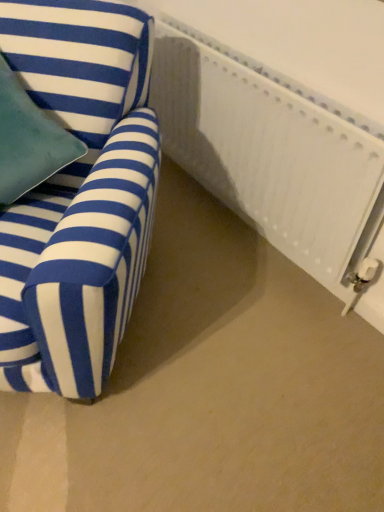
What do you see at coordinates (271, 151) in the screenshot? The image size is (384, 512). I see `white textured radiator at right` at bounding box center [271, 151].

Find the location of a particular element. white textured radiator at right is located at coordinates click(271, 151).

You are a GUI agent. You are given a task and a screenshot of the screen. Output one action in this format:
    pyautogui.click(x=<x>, y=<y>)
    Task: Click on the blue striped fabric chair at left
    The width and height of the screenshot is (384, 512).
    Given the screenshot: What is the action you would take?
    pyautogui.click(x=78, y=196)

The height and width of the screenshot is (512, 384). What do you see at coordinates (78, 196) in the screenshot? I see `blue striped fabric chair at left` at bounding box center [78, 196].

At what (x,y) coordinates should I click in order to perform the action: click on white textured radiator at right. Please return your answer as a coordinate pair (x, y). This screenshot has width=384, height=512. Looking at the image, I should click on (271, 151).

Considering the relative positions of blue striped fabric chair at left and white textured radiator at right in the image provided, is blue striped fabric chair at left to the right of white textured radiator at right from the viewer's perspective?

Incorrect, blue striped fabric chair at left is not on the right side of white textured radiator at right.

Considering the positions of objects blue striped fabric chair at left and white textured radiator at right in the image provided, who is behind, blue striped fabric chair at left or white textured radiator at right?

white textured radiator at right is further from the camera.

Considering the points (153, 204) and (265, 103), which point is in front, point (153, 204) or point (265, 103)?

The point (153, 204) is closer to the camera.

From the image's perspective, is blue striped fabric chair at left below white textured radiator at right?

Yes.

From a real-world perspective, which object stands above the other?

From a 3D spatial view, blue striped fabric chair at left is above.

Can you confirm if blue striped fabric chair at left is thinner than white textured radiator at right?

No.

Considering the relative sizes of blue striped fabric chair at left and white textured radiator at right in the image provided, is blue striped fabric chair at left taller than white textured radiator at right?

Correct, blue striped fabric chair at left is much taller as white textured radiator at right.

Looking at this image, between blue striped fabric chair at left and white textured radiator at right, which one has larger size?

Bigger between the two is blue striped fabric chair at left.

Is blue striped fabric chair at left surrounding white textured radiator at right?

No, white textured radiator at right is not a part of blue striped fabric chair at left.

Would you say blue striped fabric chair at left is a long distance from white textured radiator at right?

No, blue striped fabric chair at left is not far away from white textured radiator at right.

Does blue striped fabric chair at left turn towards white textured radiator at right?

No.

Find the location of a particular element. Image resolution: width=384 pixels, height=512 pixels. chair in front of the white textured radiator at right is located at coordinates (78, 196).

From the picture: Which object is positioned more to the right, white textured radiator at right or blue striped fabric chair at left?

Positioned to the right is white textured radiator at right.

Is white textured radiator at right further to camera compared to blue striped fabric chair at left?

Yes.

Which is behind, point (349, 134) or point (145, 72)?

The point (145, 72) is farther.

From the image's perspective, which is above, white textured radiator at right or blue striped fabric chair at left?

white textured radiator at right, from the image's perspective.

From the picture: From a real-world perspective, is white textured radiator at right located beneath blue striped fabric chair at left?

Yes, from a real-world perspective, white textured radiator at right is beneath blue striped fabric chair at left.

Considering the relative sizes of white textured radiator at right and blue striped fabric chair at left in the image provided, is white textured radiator at right wider than blue striped fabric chair at left?

No.

Consider the image. Considering the relative sizes of white textured radiator at right and blue striped fabric chair at left in the image provided, is white textured radiator at right shorter than blue striped fabric chair at left?

Yes.

Does white textured radiator at right have a larger size compared to blue striped fabric chair at left?

No, white textured radiator at right is not bigger than blue striped fabric chair at left.

Can blue striped fabric chair at left be found inside white textured radiator at right?

No, white textured radiator at right does not contain blue striped fabric chair at left.

Is white textured radiator at right directly adjacent to blue striped fabric chair at left?

white textured radiator at right is not next to blue striped fabric chair at left, and they're not touching.

Is white textured radiator at right oriented away from blue striped fabric chair at left?

Yes, white textured radiator at right's orientation is away from blue striped fabric chair at left.

Measure the distance between white textured radiator at right and blue striped fabric chair at left.

white textured radiator at right and blue striped fabric chair at left are 22.00 inches apart from each other.

You are a GUI agent. You are given a task and a screenshot of the screen. Output one action in this format:
    pyautogui.click(x=<x>, y=<y>)
    Task: Click on the chair above the white textured radiator at right (from a real-world perspective)
    Image resolution: width=384 pixels, height=512 pixels.
    Given the screenshot: What is the action you would take?
    pyautogui.click(x=78, y=196)

Identify the location of chair above the white textured radiator at right (from a real-world perspective). This screenshot has height=512, width=384. (78, 196).

The width and height of the screenshot is (384, 512). I want to click on radiator above the blue striped fabric chair at left (from the image's perspective), so click(271, 151).